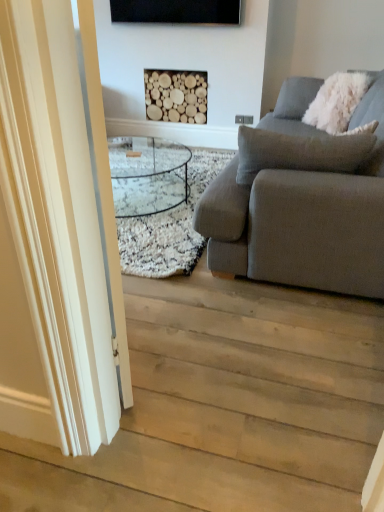
Question: Considering the relative sizes of white glossy door at left and light wood floor at lower left in the image provided, is white glossy door at left bigger than light wood floor at lower left?

Choices:
 (A) yes
 (B) no

Answer: (B)

Question: Can light wood floor at lower left be found inside white glossy door at left?

Choices:
 (A) no
 (B) yes

Answer: (A)

Question: Is white glossy door at left placed right next to light wood floor at lower left?

Choices:
 (A) yes
 (B) no

Answer: (B)

Question: From the image's perspective, is white glossy door at left over light wood floor at lower left?

Choices:
 (A) yes
 (B) no

Answer: (B)

Question: From the image's perspective, does white glossy door at left appear lower than light wood floor at lower left?

Choices:
 (A) yes
 (B) no

Answer: (A)

Question: Is white glossy door at left to the left or to the right of natural wood logs at upper center in the image?

Choices:
 (A) left
 (B) right

Answer: (A)

Question: From the image's perspective, relative to natural wood logs at upper center, is white glossy door at left above or below?

Choices:
 (A) above
 (B) below

Answer: (B)

Question: Do you think white glossy door at left is within natural wood logs at upper center, or outside of it?

Choices:
 (A) inside
 (B) outside

Answer: (B)

Question: Based on their sizes in the image, would you say white glossy door at left is bigger or smaller than natural wood logs at upper center?

Choices:
 (A) small
 (B) big

Answer: (B)

Question: In terms of width, does light wood floor at lower left look wider or thinner when compared to natural wood logs at upper center?

Choices:
 (A) thin
 (B) wide

Answer: (B)

Question: Is point (205, 467) positioned closer to the camera than point (162, 117)?

Choices:
 (A) closer
 (B) farther

Answer: (A)

Question: From a real-world perspective, is light wood floor at lower left physically located above or below natural wood logs at upper center?

Choices:
 (A) below
 (B) above

Answer: (A)

Question: From the image's perspective, is light wood floor at lower left above or below natural wood logs at upper center?

Choices:
 (A) above
 (B) below

Answer: (B)

Question: Is white fluffy pillow at upper right situated inside light wood floor at lower left or outside?

Choices:
 (A) inside
 (B) outside

Answer: (B)

Question: From a real-world perspective, is white fluffy pillow at upper right above or below light wood floor at lower left?

Choices:
 (A) below
 (B) above

Answer: (B)